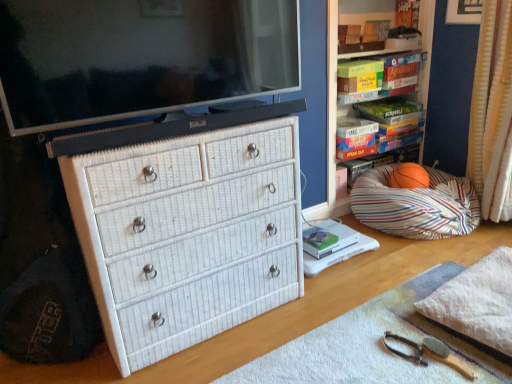
I want to click on vacant space behind white fluffy blanket at lower right, so point(436,247).